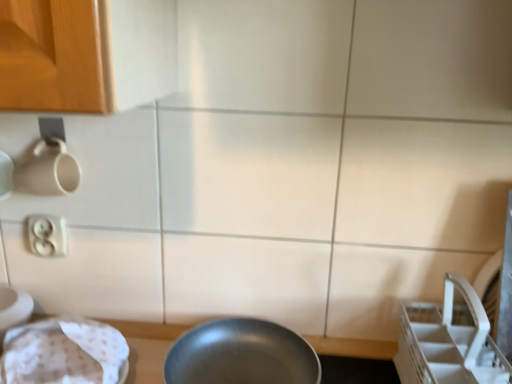
Question: Should I look upward or downward to see white plastic electric outlet at upper left?

Choices:
 (A) up
 (B) down

Answer: (B)

Question: Considering the relative sizes of white plastic electric outlet at upper left and shiny silver frying pan at center in the image provided, is white plastic electric outlet at upper left bigger than shiny silver frying pan at center?

Choices:
 (A) yes
 (B) no

Answer: (B)

Question: Considering the relative sizes of white plastic electric outlet at upper left and shiny silver frying pan at center in the image provided, is white plastic electric outlet at upper left smaller than shiny silver frying pan at center?

Choices:
 (A) no
 (B) yes

Answer: (B)

Question: Is shiny silver frying pan at center surrounded by white plastic electric outlet at upper left?

Choices:
 (A) yes
 (B) no

Answer: (B)

Question: Is white plastic electric outlet at upper left oriented away from shiny silver frying pan at center?

Choices:
 (A) yes
 (B) no

Answer: (B)

Question: Could you tell me if white plastic electric outlet at upper left is facing shiny silver frying pan at center?

Choices:
 (A) yes
 (B) no

Answer: (B)

Question: Is the depth of white plastic electric outlet at upper left less than that of shiny silver frying pan at center?

Choices:
 (A) no
 (B) yes

Answer: (A)

Question: Is shiny silver frying pan at center positioned with its back to transparent plastic sink at lower left?

Choices:
 (A) yes
 (B) no

Answer: (B)

Question: Considering the relative sizes of shiny silver frying pan at center and transparent plastic sink at lower left in the image provided, is shiny silver frying pan at center wider than transparent plastic sink at lower left?

Choices:
 (A) no
 (B) yes

Answer: (B)

Question: Is shiny silver frying pan at center smaller than transparent plastic sink at lower left?

Choices:
 (A) no
 (B) yes

Answer: (A)

Question: From the image's perspective, is shiny silver frying pan at center on top of transparent plastic sink at lower left?

Choices:
 (A) no
 (B) yes

Answer: (A)

Question: Is shiny silver frying pan at center positioned behind transparent plastic sink at lower left?

Choices:
 (A) no
 (B) yes

Answer: (B)

Question: Is there a large distance between shiny silver frying pan at center and transparent plastic sink at lower left?

Choices:
 (A) no
 (B) yes

Answer: (A)

Question: Could you tell me if transparent plastic sink at lower left is facing shiny silver frying pan at center?

Choices:
 (A) no
 (B) yes

Answer: (A)